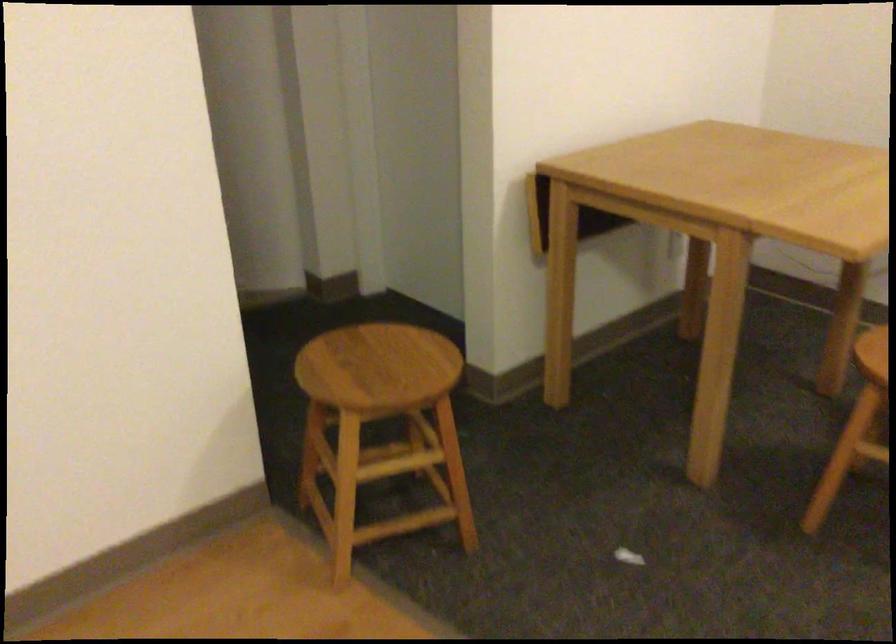
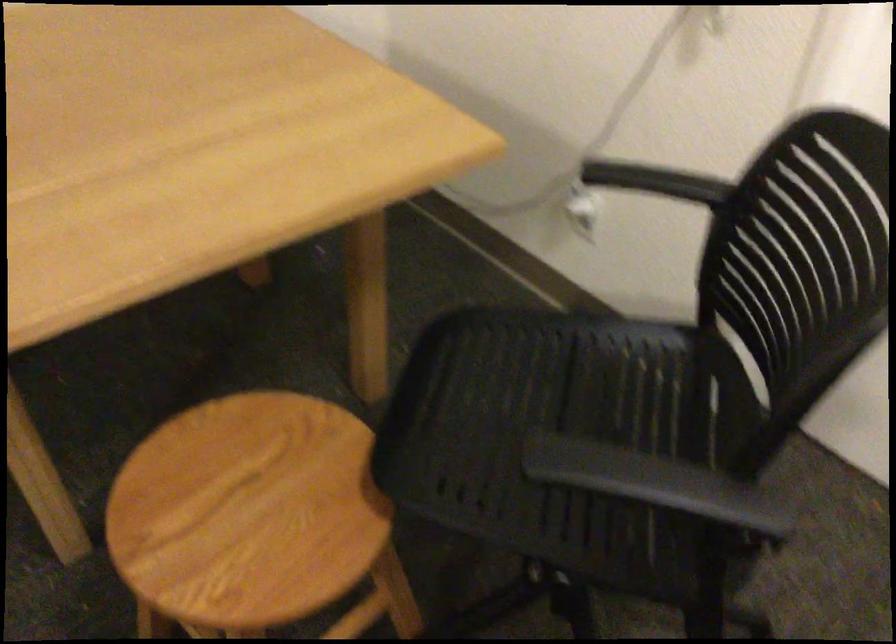
Which direction would the cameraman need to move to produce the second image?

The movement direction of the cameraman is right, forward.